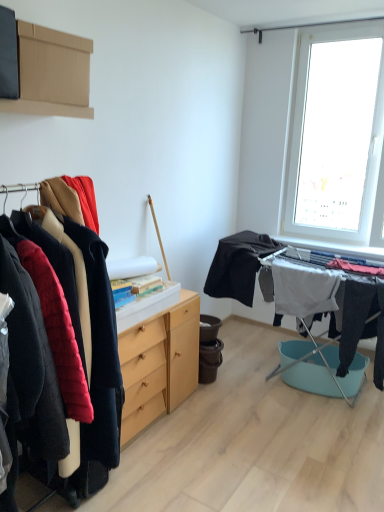
Question: Does brown cardboard box at upper left come behind black matte fabric at center, the 2th clothing in the right-to-left sequence?

Choices:
 (A) yes
 (B) no

Answer: (B)

Question: Does brown cardboard box at upper left have a lesser width compared to black matte fabric at center, the 2th clothing in the right-to-left sequence?

Choices:
 (A) no
 (B) yes

Answer: (B)

Question: Considering the relative sizes of brown cardboard box at upper left and black matte fabric at center, which appears as the 1th clothing when viewed from the left, in the image provided, is brown cardboard box at upper left wider than black matte fabric at center, which appears as the 1th clothing when viewed from the left,?

Choices:
 (A) yes
 (B) no

Answer: (B)

Question: Is brown cardboard box at upper left located outside black matte fabric at center, the 2th clothing in the right-to-left sequence?

Choices:
 (A) no
 (B) yes

Answer: (B)

Question: Considering the relative sizes of brown cardboard box at upper left and black matte fabric at center, the 2th clothing in the right-to-left sequence, in the image provided, is brown cardboard box at upper left bigger than black matte fabric at center, the 2th clothing in the right-to-left sequence,?

Choices:
 (A) no
 (B) yes

Answer: (A)

Question: Is black matte fabric at center, the 2th clothing in the right-to-left sequence, a part of brown cardboard box at upper left?

Choices:
 (A) yes
 (B) no

Answer: (B)

Question: Is white fabric at center, the 2th clothing viewed from the left, oriented away from black matte fabric at center, the 2th clothing in the right-to-left sequence?

Choices:
 (A) no
 (B) yes

Answer: (A)

Question: Is white fabric at center, the first clothing in the right-to-left sequence, bigger than black matte fabric at center, which appears as the 1th clothing when viewed from the left?

Choices:
 (A) no
 (B) yes

Answer: (A)

Question: Considering the relative positions of white fabric at center, the first clothing in the right-to-left sequence, and black matte fabric at center, which appears as the 1th clothing when viewed from the left, in the image provided, is white fabric at center, the first clothing in the right-to-left sequence, in front of black matte fabric at center, which appears as the 1th clothing when viewed from the left,?

Choices:
 (A) yes
 (B) no

Answer: (B)

Question: Is white fabric at center, the 2th clothing viewed from the left, to the left of black matte fabric at center, which appears as the 1th clothing when viewed from the left, from the viewer's perspective?

Choices:
 (A) yes
 (B) no

Answer: (B)

Question: Can black matte fabric at center, which appears as the 1th clothing when viewed from the left, be found inside white fabric at center, the 2th clothing viewed from the left?

Choices:
 (A) yes
 (B) no

Answer: (B)

Question: Are white fabric at center, the first clothing in the right-to-left sequence, and black matte fabric at center, the 2th clothing in the right-to-left sequence, located far from each other?

Choices:
 (A) yes
 (B) no

Answer: (B)

Question: Does black matte fabric at center, which appears as the 1th clothing when viewed from the left, come behind white fabric at center, the 2th clothing viewed from the left?

Choices:
 (A) no
 (B) yes

Answer: (A)